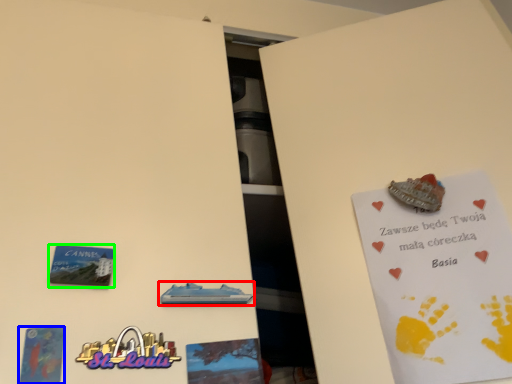
Question: Which object is positioned closest to vehicle (highlighted by a red box)? Select from postcard (highlighted by a blue box) and plaque (highlighted by a green box).

Choices:
 (A) postcard
 (B) plaque

Answer: (B)